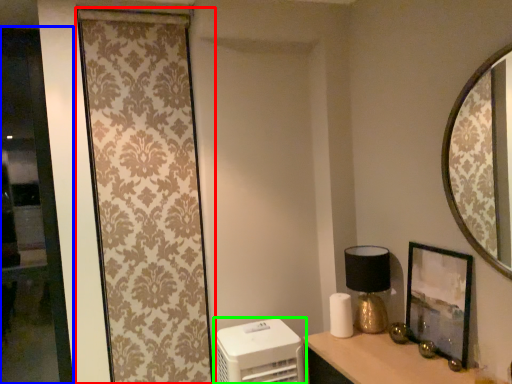
Question: Based on their relative distances, which object is nearer to curtain (highlighted by a red box)? Choose from glass door (highlighted by a blue box) and appliance (highlighted by a green box).

Choices:
 (A) glass door
 (B) appliance

Answer: (A)